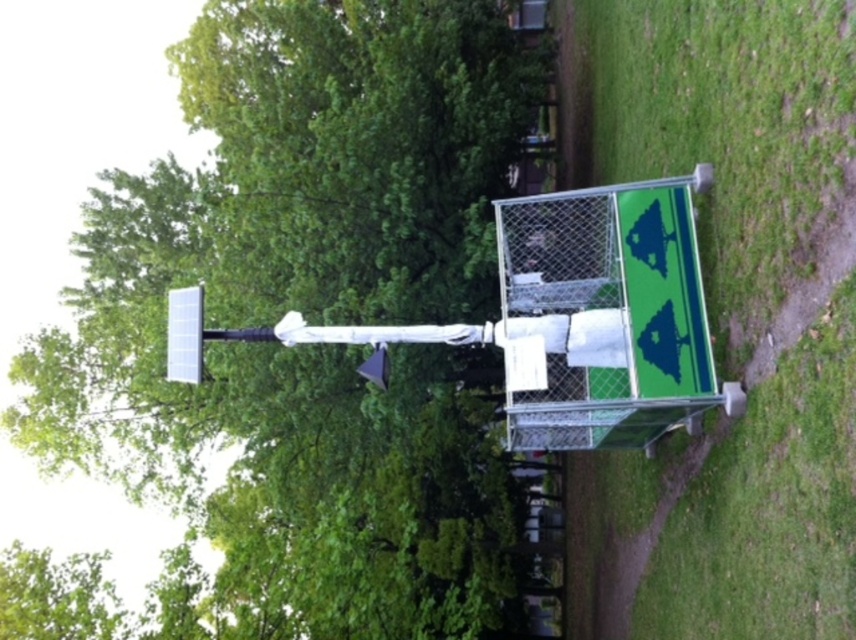
Between green leafy tree at upper center and green grass at lower right, which one is positioned higher?

green grass at lower right is higher up.

Is point (314, 456) less distant than point (699, 38)?

No, it is not.

Which is behind, point (276, 400) or point (854, 396)?

Point (276, 400)

The width and height of the screenshot is (856, 640). In order to click on green leafy tree at upper center in this screenshot , I will do `click(312, 316)`.